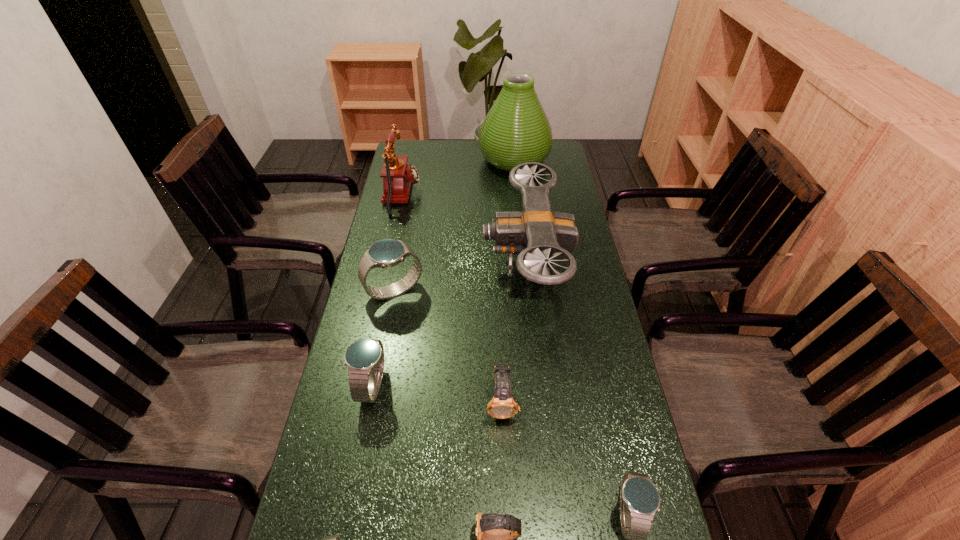
The height and width of the screenshot is (540, 960). I want to click on blank space located on the front-facing side of the drone, so click(438, 263).

Where is `vacant space located on the front-facing side of the drone`? Image resolution: width=960 pixels, height=540 pixels. vacant space located on the front-facing side of the drone is located at coordinates (468, 263).

What are the coordinates of `vacant position located 0.240m on the front-facing side of the drone` in the screenshot? It's located at (410, 263).

You are a GUI agent. You are given a task and a screenshot of the screen. Output one action in this format:
    pyautogui.click(x=<x>, y=<y>)
    Task: Click on the vacant space located 0.320m on the front of the farthest blue watch
    This screenshot has width=960, height=540.
    Given the screenshot: What is the action you would take?
    pyautogui.click(x=372, y=404)

Identify the location of free space located 0.220m on the front of the second biggest blue watch. (348, 511).

You are a GUI agent. You are given a task and a screenshot of the screen. Output one action in this format:
    pyautogui.click(x=<x>, y=<y>)
    Task: Click on the vacant space situated on the face of the bigger gold watch
    This screenshot has height=540, width=960.
    Given the screenshot: What is the action you would take?
    pyautogui.click(x=507, y=521)

Where is `object situated at the far edge`? The image size is (960, 540). object situated at the far edge is located at coordinates (516, 130).

Identify the location of telephone situated at the left edge. (398, 177).

Where is `vase that is at the right edge`? This screenshot has width=960, height=540. vase that is at the right edge is located at coordinates (516, 130).

The height and width of the screenshot is (540, 960). I want to click on drone that is at the right edge, so click(535, 233).